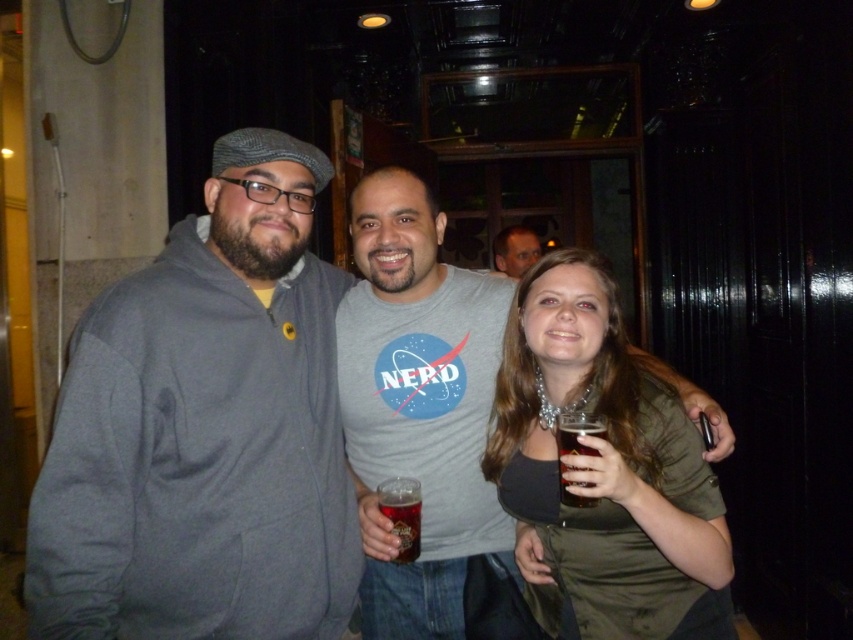
Question: Which point is farther to the camera?

Choices:
 (A) matte gray shirt at center
 (B) translucent glass mug at center
 (C) brown glass at center
 (D) gray fleece jacket at left

Answer: (A)

Question: Does gray fleece jacket at left have a lesser width compared to green matte shirt at center?

Choices:
 (A) no
 (B) yes

Answer: (A)

Question: Is gray fleece jacket at left positioned behind matte gray shirt at center?

Choices:
 (A) yes
 (B) no

Answer: (B)

Question: Among these objects, which one is nearest to the camera?

Choices:
 (A) matte gray shirt at center
 (B) green matte shirt at center
 (C) gray fleece jacket at left
 (D) translucent glass mug at center

Answer: (C)

Question: Does green matte shirt at center appear over translucent glass mug at center?

Choices:
 (A) yes
 (B) no

Answer: (A)

Question: Which object is positioned closest to the gray fleece jacket at left?

Choices:
 (A) matte gray shirt at center
 (B) translucent glass mug at center

Answer: (B)